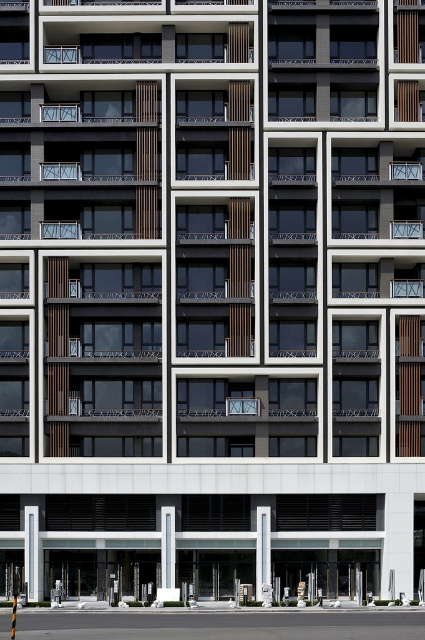
In the scene shown: You are standing at the base of the building and looking up at the balconies. You notice two points marked on the facade. Which of the two points, point (261, 509) or point (170, 563), is located higher up on the building?

Point (261, 509) is located higher up on the building than point (170, 563).

You are a delivery person with a cart that is 3 meters wide. You need to move through the space between the white concrete pillar at center and the white glossy pillar at center. Can your cart fit through the gap between them?

The distance between the white concrete pillar at center and the white glossy pillar at center is 3.31 meters. Since your cart is 3 meters wide, it can fit through the gap as there is enough space.

You are an architect reviewing the building plans and notice two pillars at the center of the building. The first is labeled as the white concrete pillar at center and the second is the white glossy pillar at center. Which of these pillars is bigger in size?

The white concrete pillar at center is larger in size than the white glossy pillar at center.